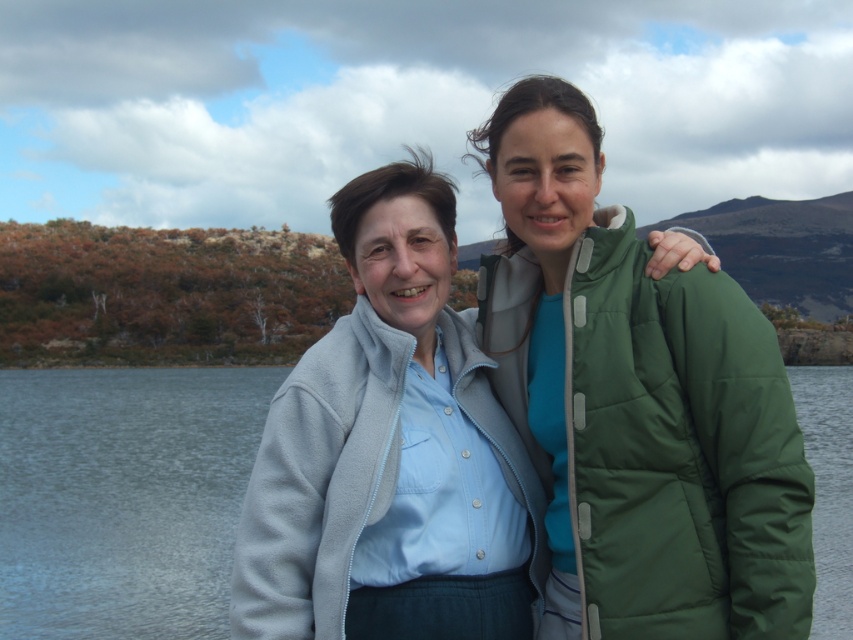
Question: Which point is closer to the camera taking this photo?

Choices:
 (A) (132, 586)
 (B) (531, 474)

Answer: (B)

Question: Does green puffy jacket at center appear on the left side of transparent water at center?

Choices:
 (A) yes
 (B) no

Answer: (A)

Question: Is green puffy jacket at center positioned in front of light blue fleece jacket at center?

Choices:
 (A) no
 (B) yes

Answer: (B)

Question: Among these points, which one is farthest from the camera?

Choices:
 (A) (119, 397)
 (B) (502, 349)

Answer: (A)

Question: Does green puffy jacket at center have a larger size compared to light blue fleece jacket at center?

Choices:
 (A) no
 (B) yes

Answer: (A)

Question: Which object is farther from the camera taking this photo?

Choices:
 (A) light blue fleece jacket at center
 (B) green puffy jacket at center
 (C) transparent water at center

Answer: (A)